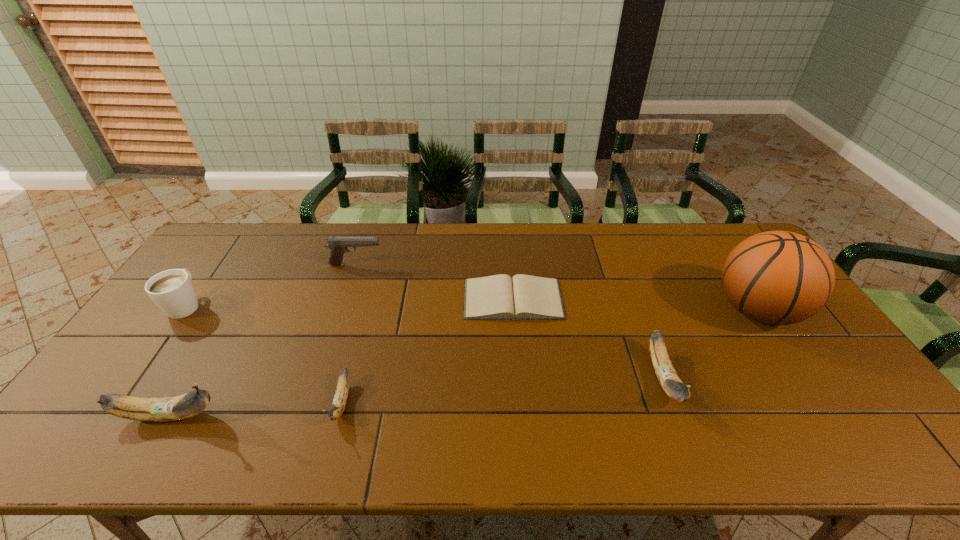
At what (x,y) coordinates should I click in order to perform the action: click on Bible. Please return your answer as a coordinate pair (x, y). Image resolution: width=960 pixels, height=540 pixels. Looking at the image, I should click on (496, 297).

I want to click on free space located on the peel of the leftmost banana, so click(321, 416).

You are a GUI agent. You are given a task and a screenshot of the screen. Output one action in this format:
    pyautogui.click(x=<x>, y=<y>)
    Task: Click on the vacant region located at the barrel of the pistol
    The height and width of the screenshot is (540, 960).
    Given the screenshot: What is the action you would take?
    pyautogui.click(x=445, y=265)

At what (x,y) coordinates should I click in order to perform the action: click on vacant region located 0.330m with the handle on the side of the cappuccino. Please return your answer as a coordinate pair (x, y). Looking at the image, I should click on click(x=240, y=229).

The width and height of the screenshot is (960, 540). In order to click on vacant area situated 0.210m with the handle on the side of the cappuccino in this screenshot , I will do `click(227, 248)`.

Where is `free region located with the handle on the side of the cappuccino`? This screenshot has height=540, width=960. free region located with the handle on the side of the cappuccino is located at coordinates (216, 263).

You are a GUI agent. You are given a task and a screenshot of the screen. Output one action in this format:
    pyautogui.click(x=<x>, y=<y>)
    Task: Click on the free region located on the front of the rightmost object
    
    Given the screenshot: What is the action you would take?
    pyautogui.click(x=812, y=394)

Find the location of a particular element. vacant space located on the back of the shortest object is located at coordinates (508, 233).

Locate an element on the screen. The width and height of the screenshot is (960, 540). object situated at the far edge is located at coordinates (338, 245).

The height and width of the screenshot is (540, 960). I want to click on banana that is at the left edge, so (x=160, y=409).